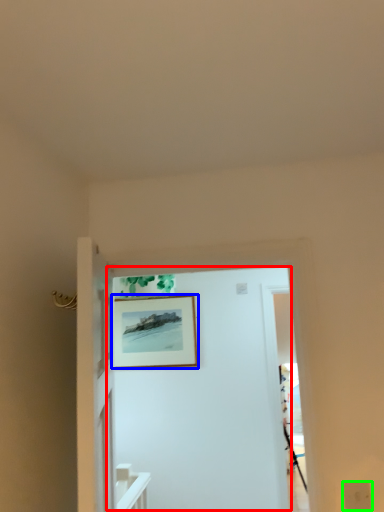
Question: Which object is the closest to the door (highlighted by a red box)? Choose among these: picture frame (highlighted by a blue box) or electric outlet (highlighted by a green box).

Choices:
 (A) picture frame
 (B) electric outlet

Answer: (A)